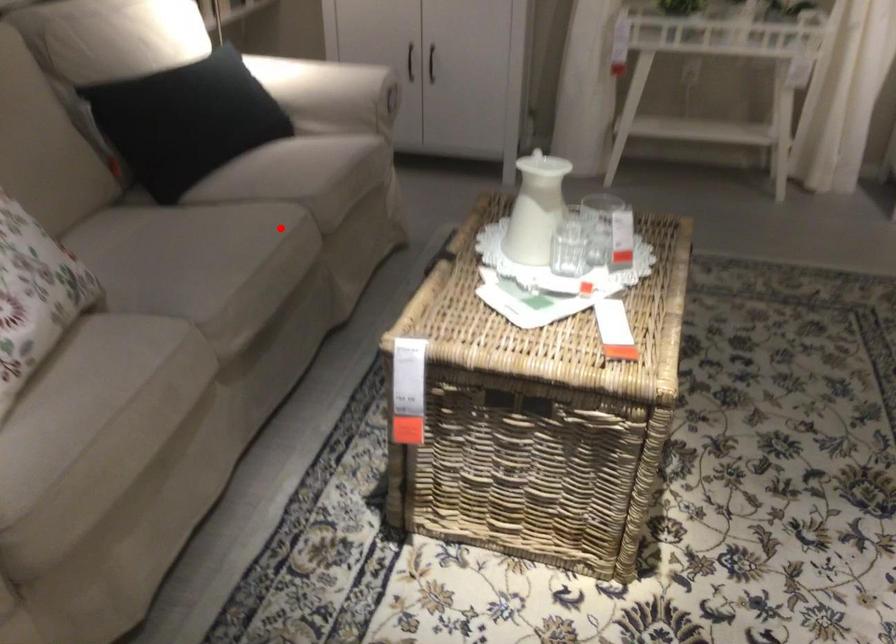
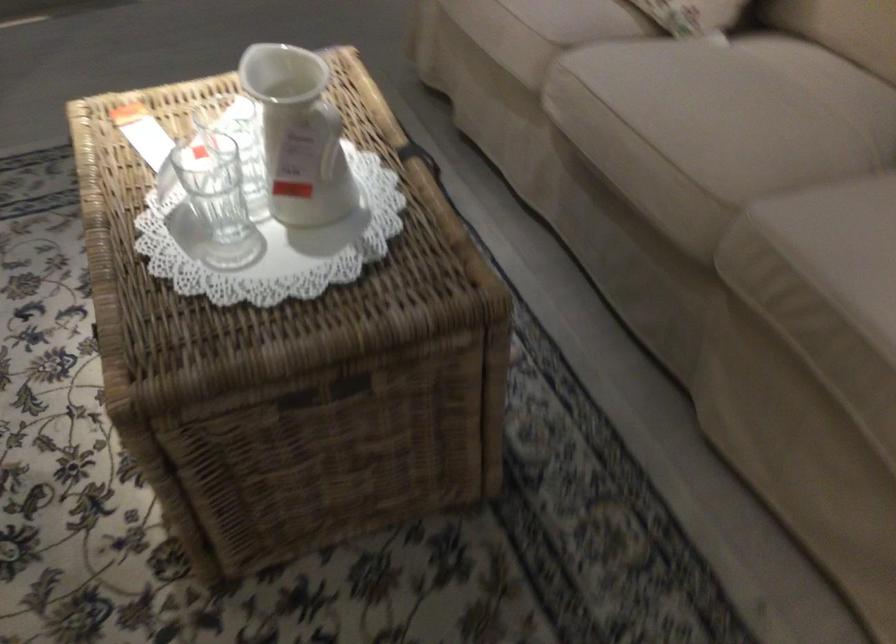
Question: A red point is marked in image1. In image2, is the corresponding 3D point closer to the camera or farther? Reply with the corresponding letter.

Choices:
 (A) The corresponding 3D point is closer.
 (B) The corresponding 3D point is farther.

Answer: (A)